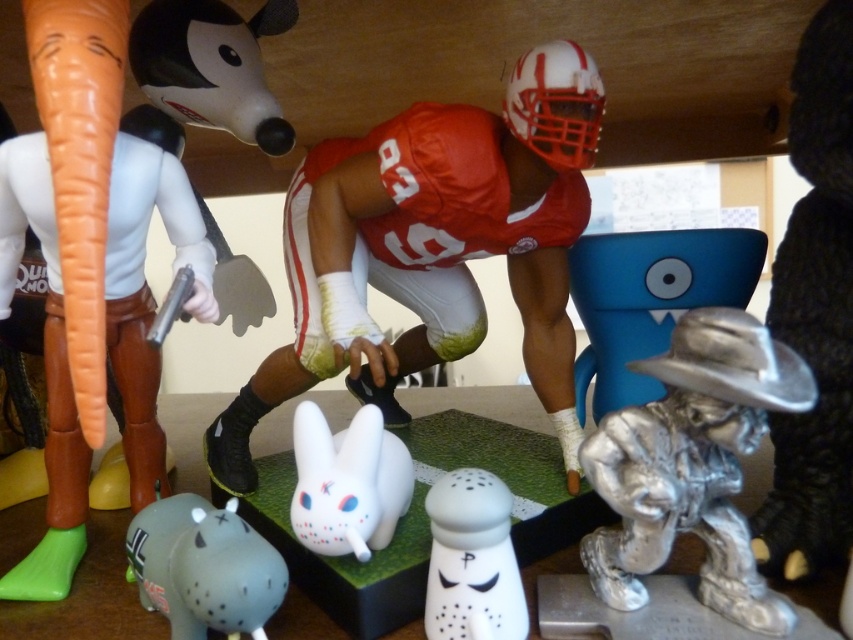
Based on the provided scene description, what are the exact 2D coordinates of the smooth white rabbit at lower left?

The smooth white rabbit at lower left is located at the 2D coordinates of point [181,195].